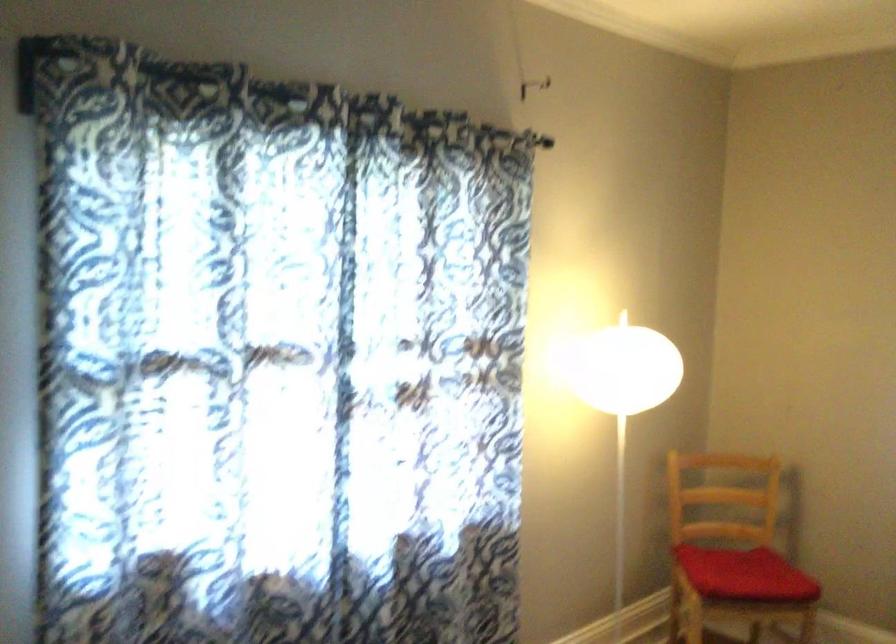
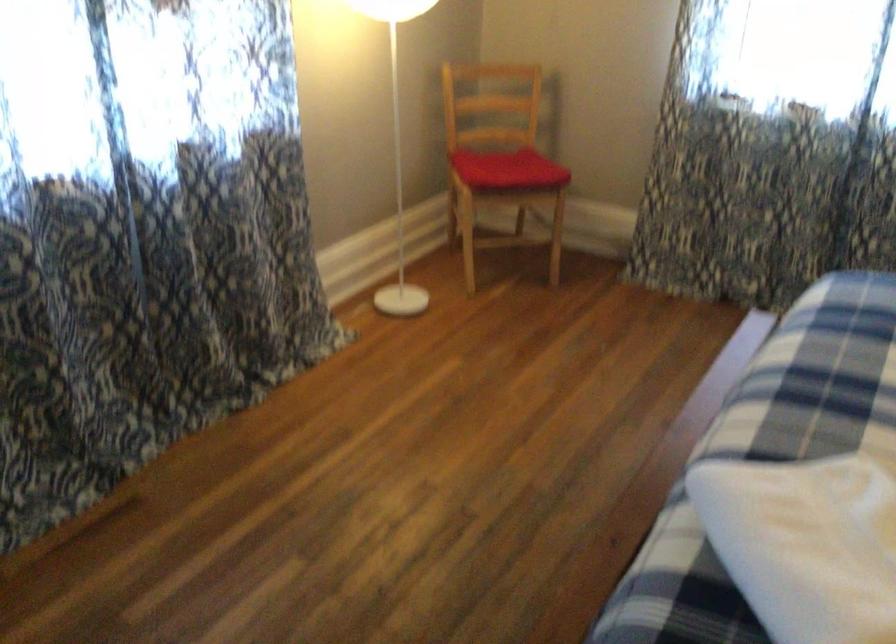
Based on the photo, the first image is from the beginning of the video and the second image is from the end. How did the camera likely rotate when shooting the video?

The rotation direction of the camera is right-down.